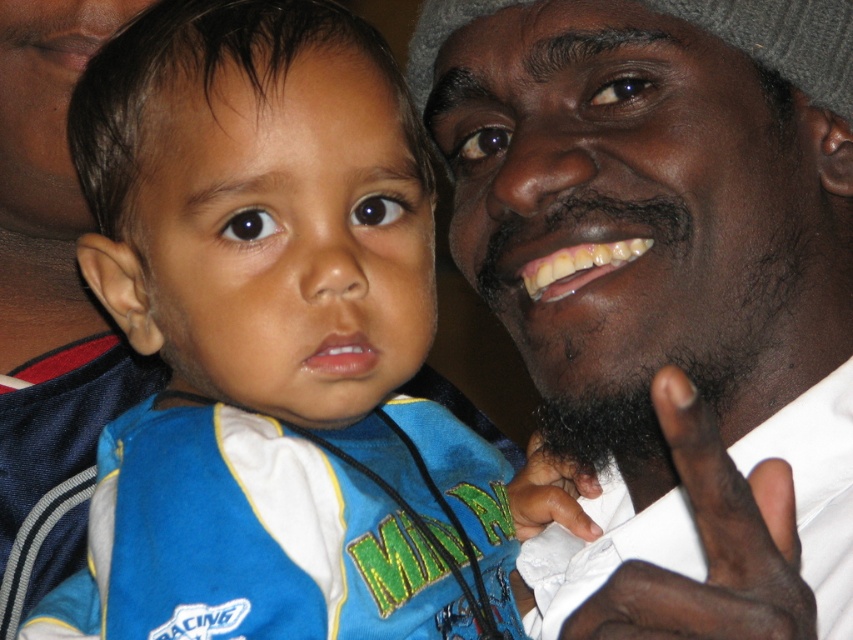
You are a photographer trying to capture a candid shot of the dark skin hand at lower center and the black fuzzy beard at right. Which object should you focus on first if you want to start from the left side of the frame?

You should focus on the dark skin hand at lower center first because it is positioned to the left of the black fuzzy beard at right.

Where is the black fuzzy beard at right located in the image?

The black fuzzy beard at right is located at point (637, 316) in the image.

You are taking a photo of the two people in the scene. You want to focus on the point closer to the camera. Which point should you choose between point (x=730, y=316) and point (x=526, y=460)?

You should choose point (x=730, y=316) because it is closer to the camera than point (x=526, y=460).